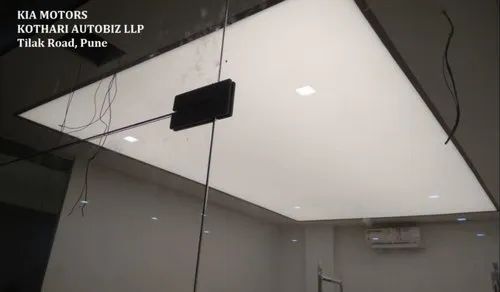
You are a GUI agent. You are given a task and a screenshot of the screen. Output one action in this format:
    pyautogui.click(x=<x>, y=<y>)
    Task: Click on the walls
    This screenshot has height=292, width=500.
    Given the screenshot: What is the action you would take?
    coord(154,225), coord(253,259), coord(416,262)